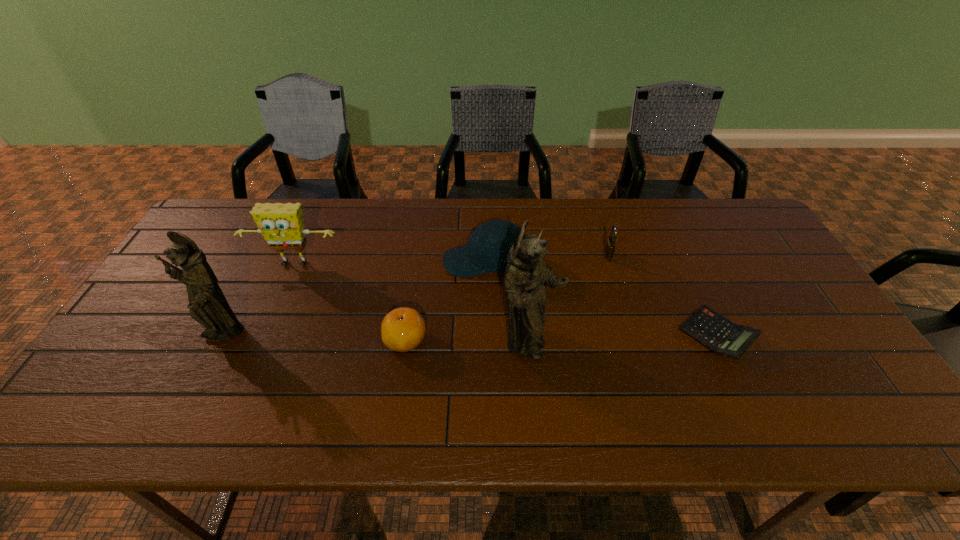
The image size is (960, 540). In order to click on the left figurine in this screenshot , I will do `click(208, 306)`.

Where is `the second tallest object`? The width and height of the screenshot is (960, 540). the second tallest object is located at coordinates (208, 306).

I want to click on the taller figurine, so [x=526, y=276].

The height and width of the screenshot is (540, 960). What are the coordinates of `the right figurine` in the screenshot? It's located at (526, 276).

The width and height of the screenshot is (960, 540). I want to click on the second object from right to left, so click(x=610, y=244).

The width and height of the screenshot is (960, 540). In order to click on padlock in this screenshot , I will do `click(610, 244)`.

Locate an element on the screen. This screenshot has height=540, width=960. the third tallest object is located at coordinates (282, 226).

You are a GUI agent. You are given a task and a screenshot of the screen. Output one action in this format:
    pyautogui.click(x=<x>, y=<y>)
    Task: Click on the rightmost object
    The image size is (960, 540).
    Given the screenshot: What is the action you would take?
    pyautogui.click(x=712, y=330)

Identify the location of calculator. The height and width of the screenshot is (540, 960). (712, 330).

Locate an element on the screen. This screenshot has height=540, width=960. baseball cap is located at coordinates [x=483, y=253].